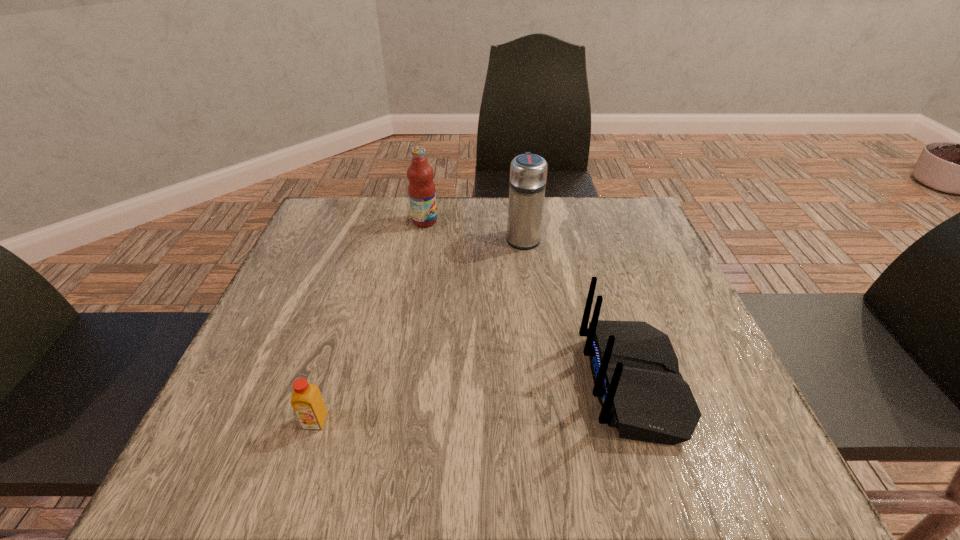
Image resolution: width=960 pixels, height=540 pixels. In order to click on object that is at the near left corner in this screenshot , I will do `click(307, 402)`.

Find the location of a particular element. object at the near right corner is located at coordinates (635, 370).

Find the location of `vacant region at the far edge of the desktop`. vacant region at the far edge of the desktop is located at coordinates (552, 243).

At what (x,y) coordinates should I click in order to perform the action: click on free space at the near edge of the desktop. Please return your answer as a coordinate pair (x, y). Looking at the image, I should click on (361, 430).

Locate an element on the screen. vacant region at the left edge of the desktop is located at coordinates (301, 338).

This screenshot has width=960, height=540. Find the location of `free space at the right edge`. free space at the right edge is located at coordinates (630, 305).

At what (x,y) coordinates should I click in order to perform the action: click on vacant space at the far left corner of the desktop. Please return your answer as a coordinate pair (x, y). Looking at the image, I should click on (375, 204).

At what (x,y) coordinates should I click in order to perform the action: click on vacant position at the far right corner of the desktop. Please return your answer as a coordinate pair (x, y). The width and height of the screenshot is (960, 540). Looking at the image, I should click on (601, 224).

Locate an element on the screen. The height and width of the screenshot is (540, 960). vacant point located between the router and the shortest object is located at coordinates (474, 402).

Locate an element on the screen. Image resolution: width=960 pixels, height=540 pixels. vacant space that is in between the orange juice and the fruit juice is located at coordinates (371, 321).